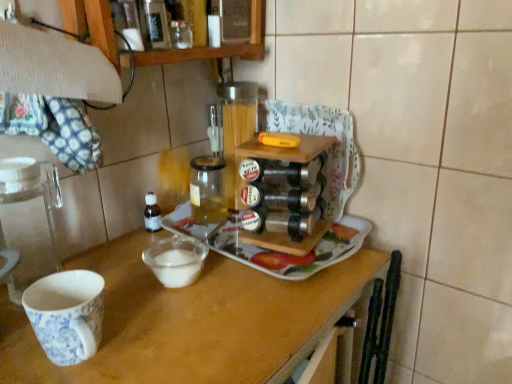
You are a GUI agent. You are given a task and a screenshot of the screen. Output one action in this format:
    pyautogui.click(x=<x>, y=<y>)
    Task: Click on the free space that is to the left of translucent glass jar at center
    The width and height of the screenshot is (512, 384).
    Given the screenshot: What is the action you would take?
    pyautogui.click(x=137, y=239)